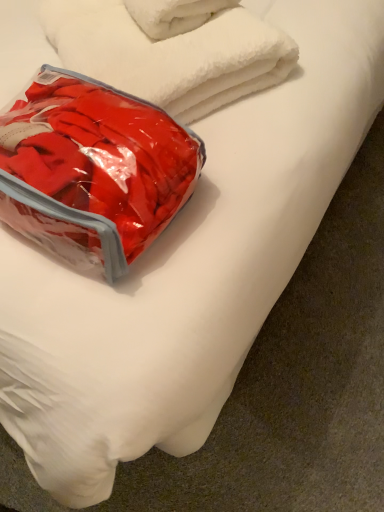
Question: Considering the relative sizes of transparent plastic bag at upper left and white fluffy towel at upper center in the image provided, is transparent plastic bag at upper left thinner than white fluffy towel at upper center?

Choices:
 (A) yes
 (B) no

Answer: (A)

Question: Is transparent plastic bag at upper left positioned behind white fluffy towel at upper center?

Choices:
 (A) no
 (B) yes

Answer: (A)

Question: Could white fluffy towel at upper center be considered to be inside transparent plastic bag at upper left?

Choices:
 (A) no
 (B) yes

Answer: (A)

Question: Is transparent plastic bag at upper left far away from white fluffy towel at upper center?

Choices:
 (A) no
 (B) yes

Answer: (A)

Question: Can you confirm if transparent plastic bag at upper left is bigger than white fluffy towel at upper center?

Choices:
 (A) no
 (B) yes

Answer: (A)

Question: Is transparent plastic bag at upper left oriented away from white fluffy towel at upper center?

Choices:
 (A) no
 (B) yes

Answer: (A)

Question: Is white fluffy towel at upper center directly adjacent to transparent plastic bag at upper left?

Choices:
 (A) no
 (B) yes

Answer: (A)

Question: Is white fluffy towel at upper center to the left of transparent plastic bag at upper left from the viewer's perspective?

Choices:
 (A) no
 (B) yes

Answer: (A)

Question: Considering the relative positions of white fluffy towel at upper center and transparent plastic bag at upper left in the image provided, is white fluffy towel at upper center in front of transparent plastic bag at upper left?

Choices:
 (A) yes
 (B) no

Answer: (B)

Question: Can you confirm if white fluffy towel at upper center is bigger than transparent plastic bag at upper left?

Choices:
 (A) no
 (B) yes

Answer: (B)

Question: From a real-world perspective, is white fluffy towel at upper center under transparent plastic bag at upper left?

Choices:
 (A) no
 (B) yes

Answer: (B)

Question: Is white fluffy towel at upper center located outside transparent plastic bag at upper left?

Choices:
 (A) no
 (B) yes

Answer: (B)

Question: Considering the positions of transparent plastic bag at upper left and white fluffy towel at upper center in the image, is transparent plastic bag at upper left bigger or smaller than white fluffy towel at upper center?

Choices:
 (A) big
 (B) small

Answer: (B)